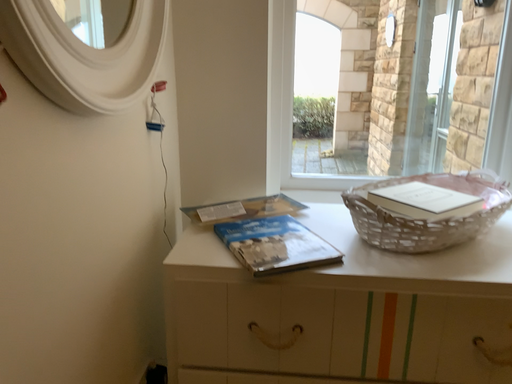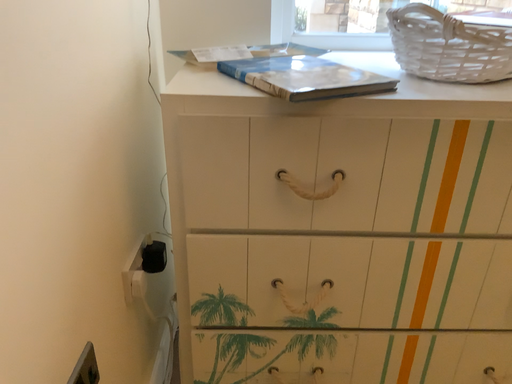
Question: How did the camera likely rotate when shooting the video?

Choices:
 (A) rotated upward
 (B) rotated downward

Answer: (B)